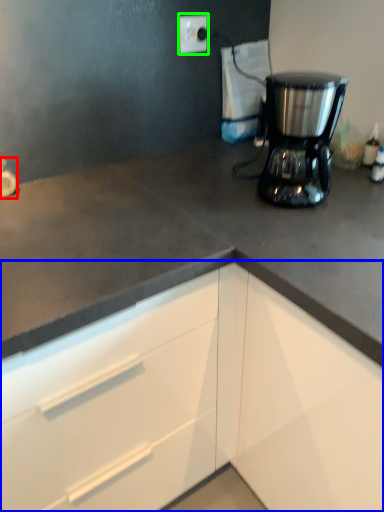
Question: Which object is the farthest from faucet (highlighted by a red box)? Choose among these: cabinetry (highlighted by a blue box) or electric outlet (highlighted by a green box).

Choices:
 (A) cabinetry
 (B) electric outlet

Answer: (A)